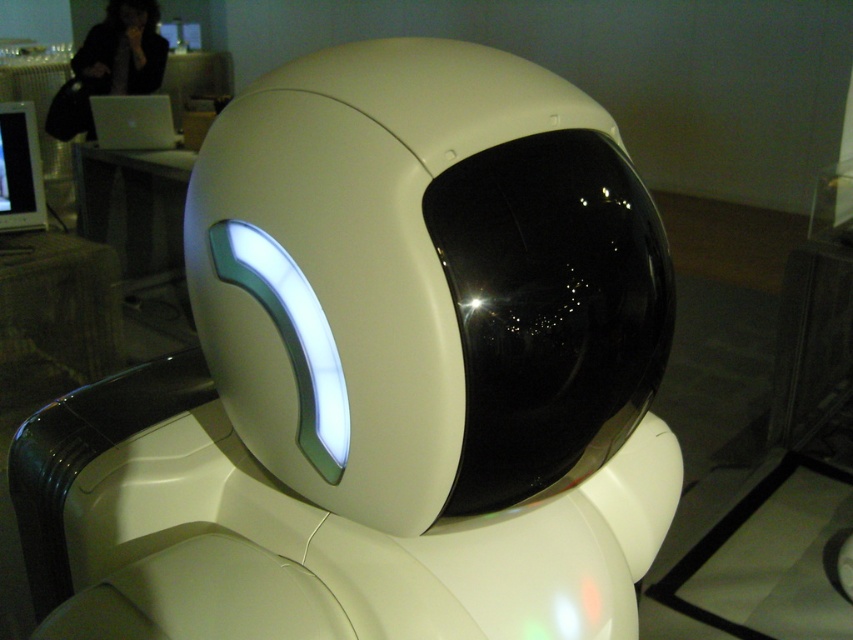
Is white glossy robot head at center wider than silver metallic laptop at upper left?

Yes.

Can you confirm if white glossy robot head at center is taller than silver metallic laptop at upper left?

Yes, white glossy robot head at center is taller than silver metallic laptop at upper left.

Is point (361, 112) behind point (129, 124)?

No, it is in front of (129, 124).

Locate an element on the screen. Image resolution: width=853 pixels, height=640 pixels. white glossy robot head at center is located at coordinates (379, 376).

Is point (650, 371) positioned behind point (0, 193)?

No, (650, 371) is in front of (0, 193).

In the scene shown: Is white glossy robot head at center to the left of matte black monitor at left from the viewer's perspective?

In fact, white glossy robot head at center is to the right of matte black monitor at left.

Locate an element on the screen. This screenshot has width=853, height=640. white glossy robot head at center is located at coordinates (379, 376).

In order to click on white glossy robot head at center in this screenshot , I will do `click(379, 376)`.

What do you see at coordinates (19, 170) in the screenshot?
I see `matte black monitor at left` at bounding box center [19, 170].

Is point (32, 160) positioned before point (144, 99)?

Yes, it is in front of point (144, 99).

Where is `matte black monitor at left`? The image size is (853, 640). matte black monitor at left is located at coordinates (19, 170).